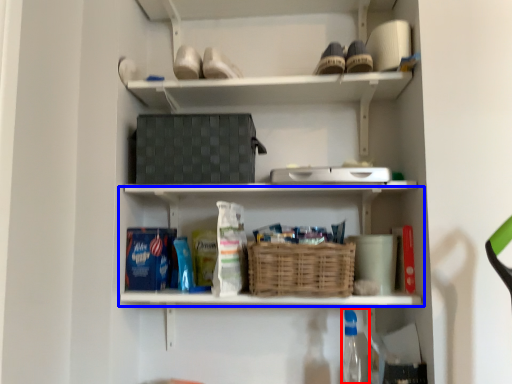
Question: Which object appears closest to the camera in this image, bottle (highlighted by a red box) or shelf (highlighted by a blue box)?

Choices:
 (A) bottle
 (B) shelf

Answer: (A)